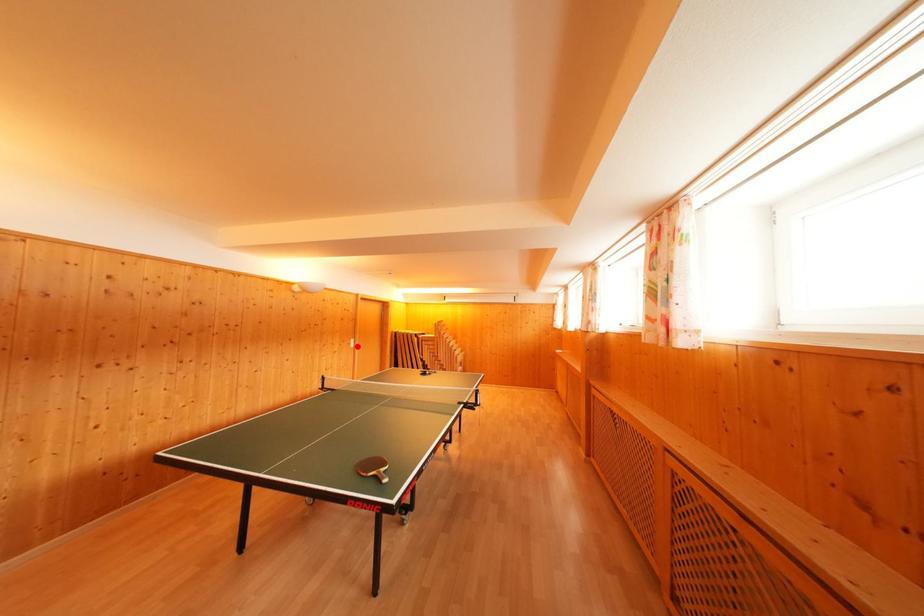
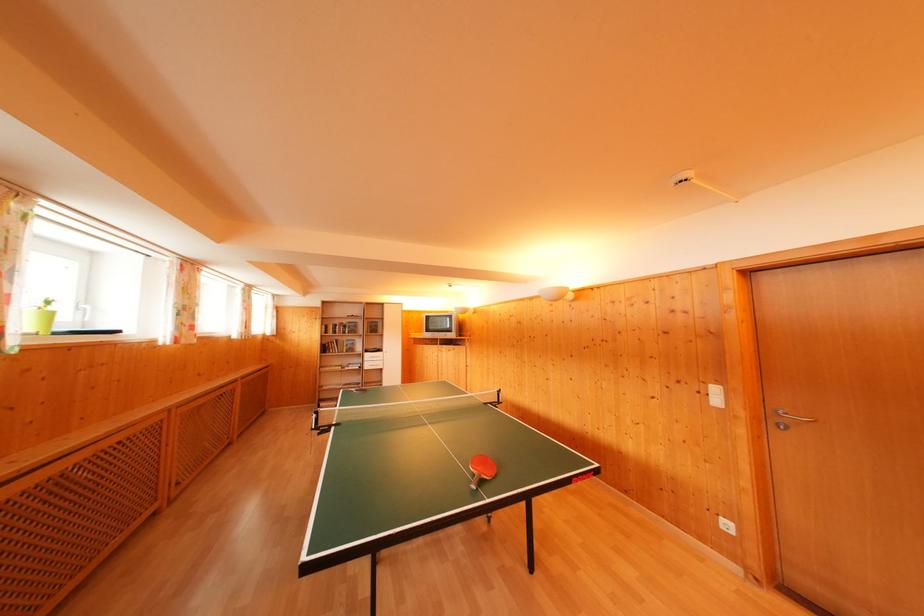
Question: I am providing you with two images of the same scene from different viewpoints. A red point is shown in image1. For the corresponding object point in image2, is it positioned nearer or farther from the camera?

Choices:
 (A) Nearer
 (B) Farther

Answer: (A)